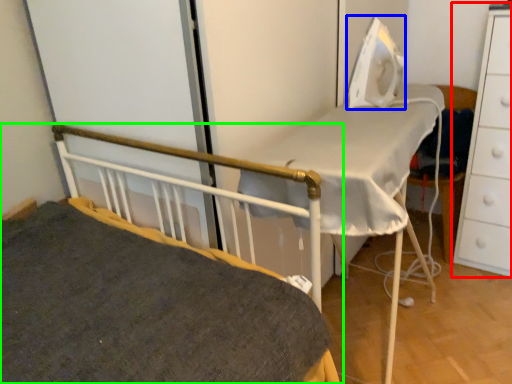
Question: Which object is positioned farthest from chest of drawers (highlighted by a red box)? Select from equipment (highlighted by a blue box) and bed (highlighted by a green box).

Choices:
 (A) equipment
 (B) bed

Answer: (B)